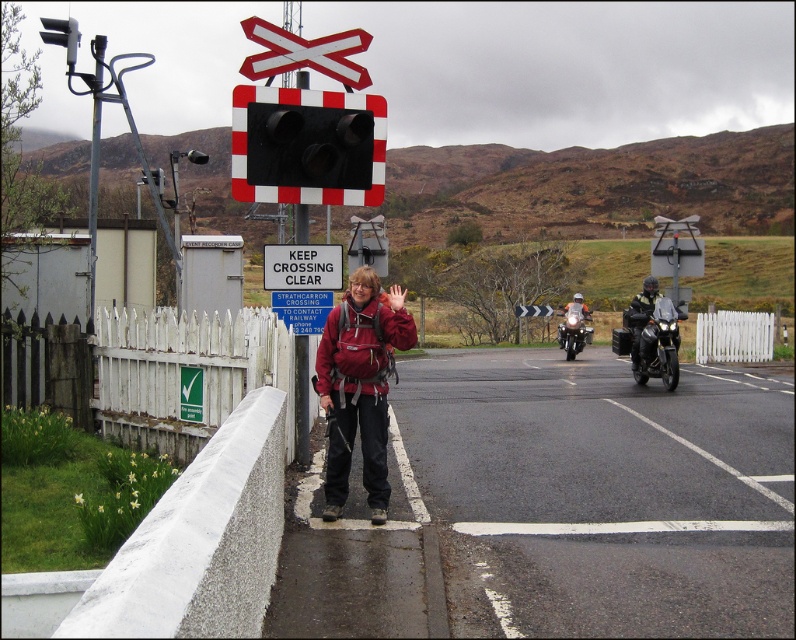
Is point (246, 106) positioned in front of point (330, 275)?

Yes, it is.

Can you confirm if black matte traffic light at center is shorter than white plastic sign at center?

In fact, black matte traffic light at center may be taller than white plastic sign at center.

Which is behind, point (240, 100) or point (276, 256)?

Positioned behind is point (276, 256).

The width and height of the screenshot is (796, 640). In order to click on black matte traffic light at center in this screenshot , I will do `click(307, 145)`.

Is shiny black motorcycle at center-right below shiny chrome motorcycle at center?

Yes.

Is shiny black motorcycle at center-right closer to the viewer compared to shiny chrome motorcycle at center?

Yes, it is in front of shiny chrome motorcycle at center.

Does point (658, 339) come behind point (572, 340)?

No, it is not.

I want to click on shiny black motorcycle at center-right, so click(654, 336).

Locate an element on the screen. The width and height of the screenshot is (796, 640). shiny black motorcycle at center-right is located at coordinates (654, 336).

Does shiny black motorcycle at center-right appear over white plastic sign at center?

Incorrect, shiny black motorcycle at center-right is not positioned above white plastic sign at center.

This screenshot has width=796, height=640. I want to click on shiny black motorcycle at center-right, so click(x=654, y=336).